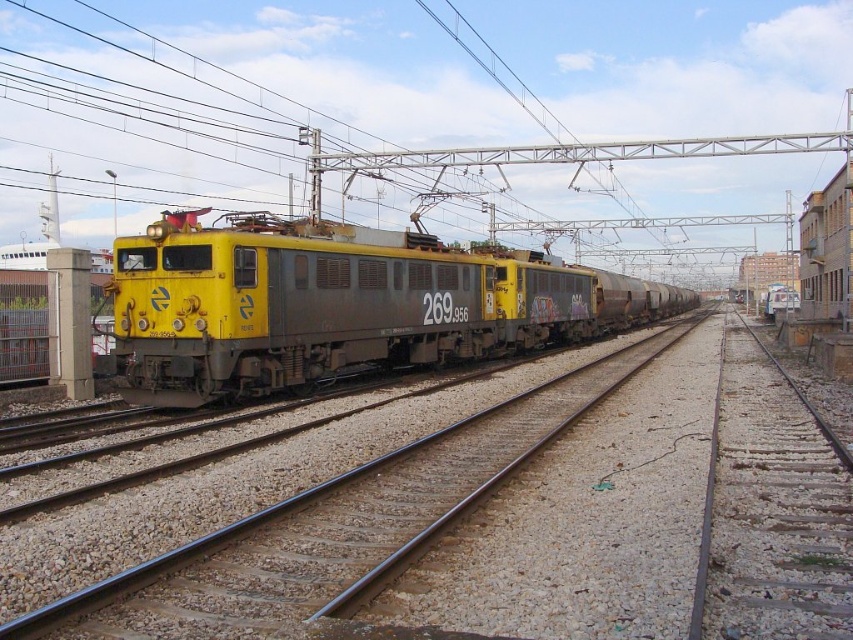
Question: Is yellow/grey metal train tracks at center behind yellow matte train at center?

Choices:
 (A) no
 (B) yes

Answer: (A)

Question: Is yellow/grey metal train tracks at center wider than yellow matte train at center?

Choices:
 (A) no
 (B) yes

Answer: (A)

Question: Among these objects, which one is nearest to the camera?

Choices:
 (A) yellow matte train at center
 (B) yellow/grey metal train tracks at center

Answer: (B)

Question: Is yellow/grey metal train tracks at center to the right of yellow matte train at center from the viewer's perspective?

Choices:
 (A) no
 (B) yes

Answer: (A)